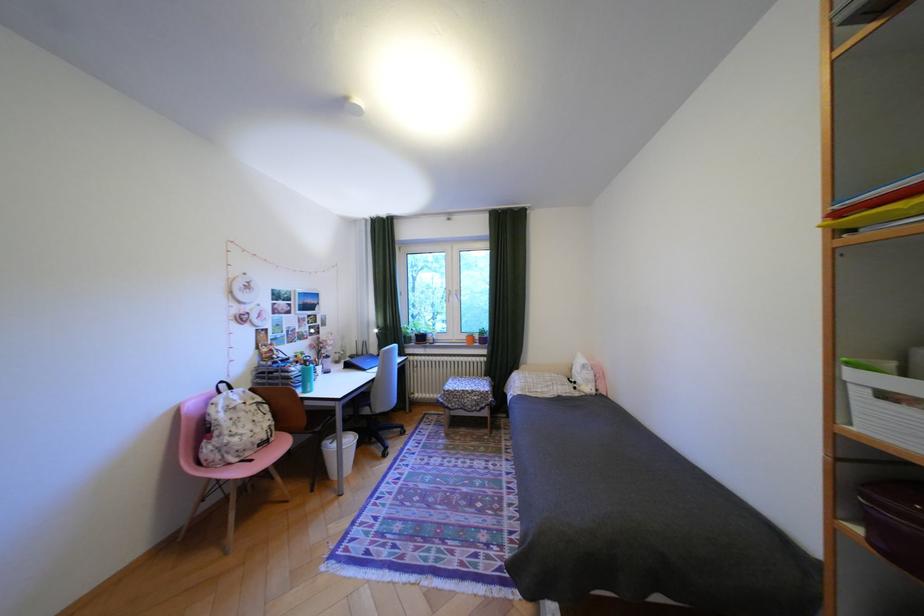
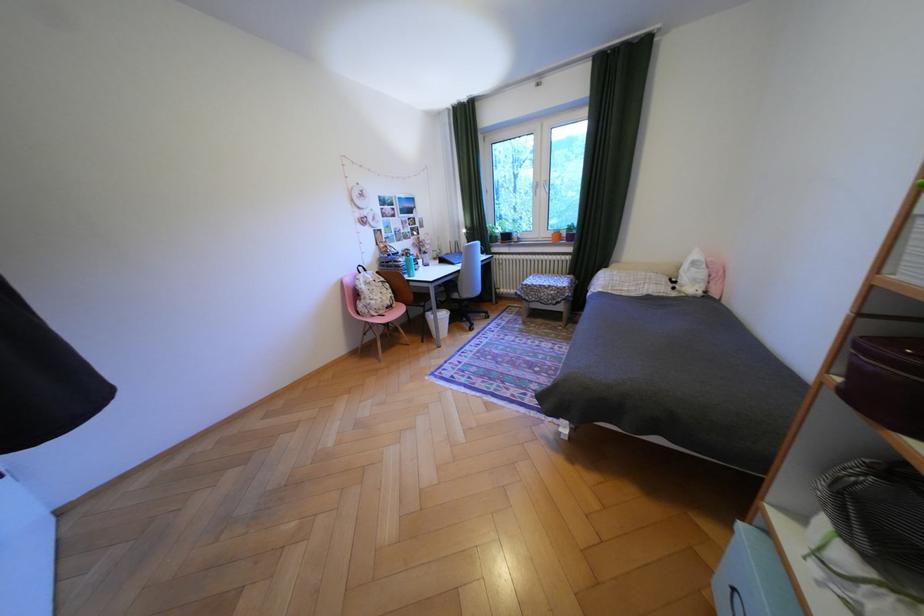
In the second image, find the point that corresponds to (x=605, y=392) in the first image.

(712, 293)